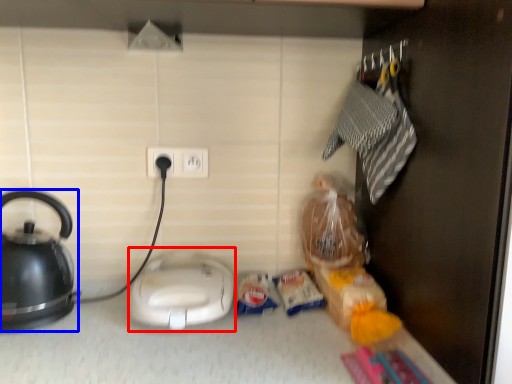
Question: Which of the following is the farthest to the observer, appliance (highlighted by a red box) or kettle (highlighted by a blue box)?

Choices:
 (A) appliance
 (B) kettle

Answer: (A)